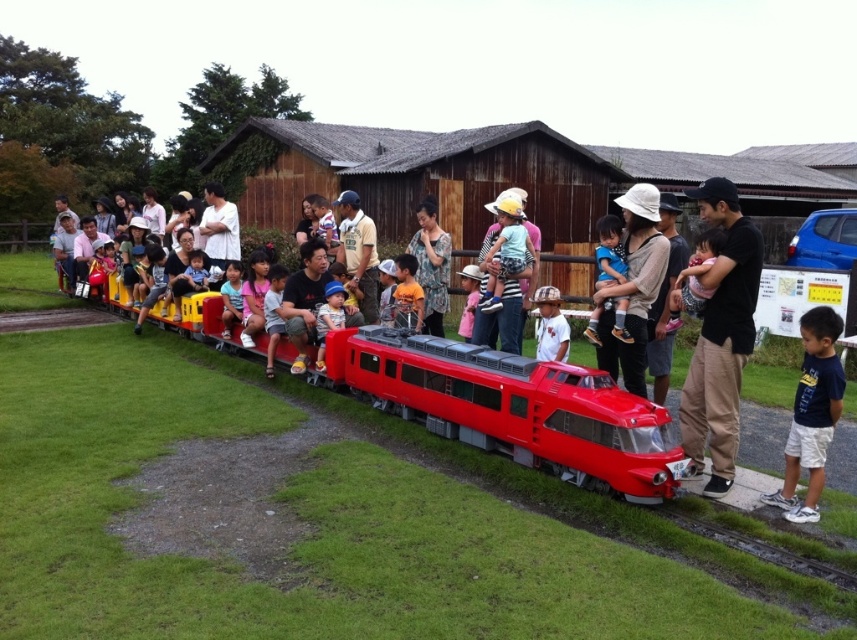
Based on the photo, you are a child who wants to choose a toy to play with. You see the shiny plastic train at center and the matte plastic toy at center. Which one is bigger?

The shiny plastic train at center is larger in size than the matte plastic toy at center.